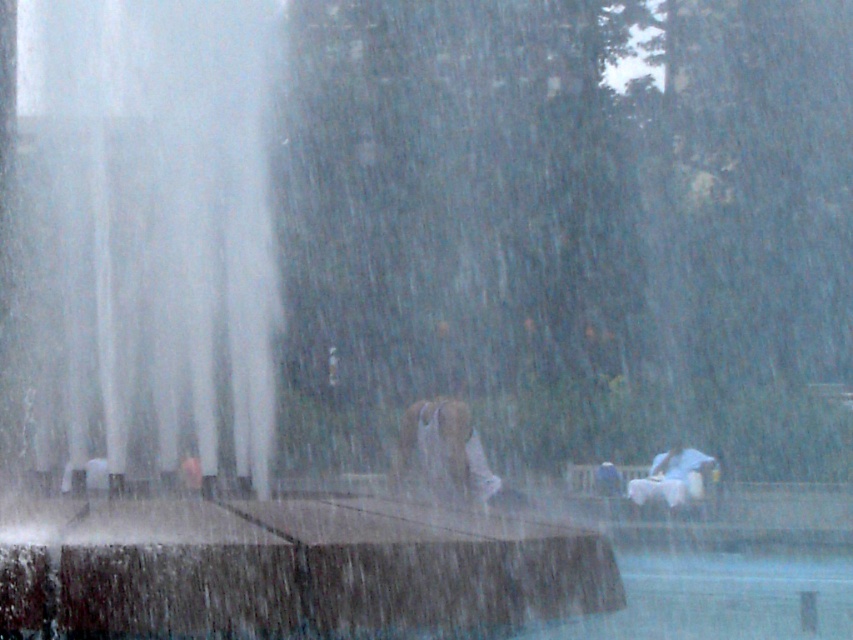
Question: Is transparent glass fountain at center smaller than white matte horse at lower right?

Choices:
 (A) no
 (B) yes

Answer: (A)

Question: Where is transparent glass fountain at center located in relation to white matte horse at lower right in the image?

Choices:
 (A) above
 (B) below

Answer: (A)

Question: Where is transparent glass fountain at center located in relation to white matte horse at lower right in the image?

Choices:
 (A) left
 (B) right

Answer: (A)

Question: Which point is farther from the camera taking this photo?

Choices:
 (A) (119, 116)
 (B) (703, 476)

Answer: (B)

Question: Among these points, which one is nearest to the camera?

Choices:
 (A) (686, 497)
 (B) (286, 508)

Answer: (B)